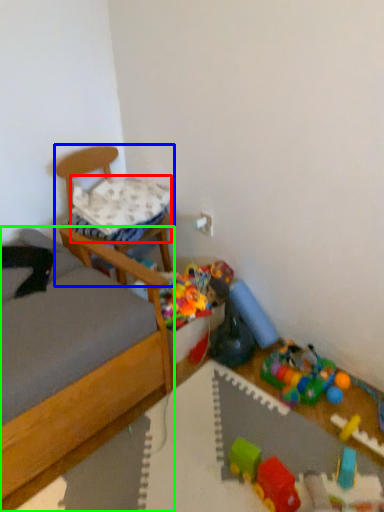
Question: Which is nearer to the pillow (highlighted by a red box)? chair (highlighted by a blue box) or bed (highlighted by a green box).

Choices:
 (A) chair
 (B) bed

Answer: (A)